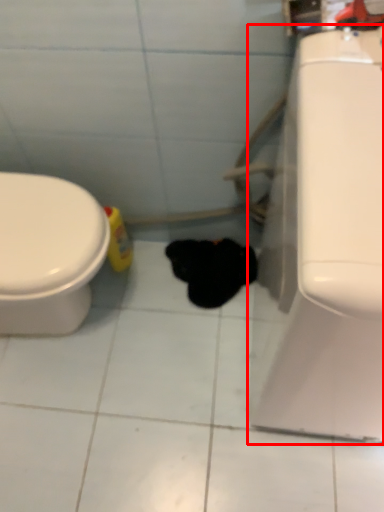
Question: In this image, where is porcelain (annotated by the red box) located relative to animal?

Choices:
 (A) left
 (B) right

Answer: (B)